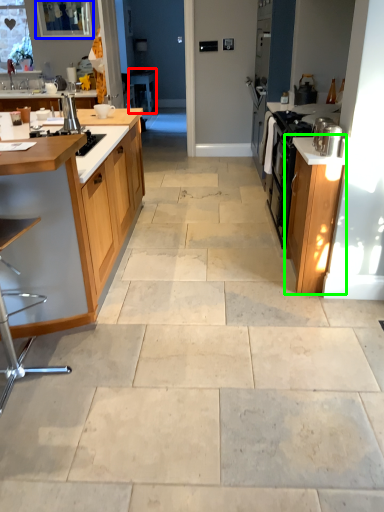
Question: Which object is positioned closest to table (highlighted by a red box)? Select from window screen (highlighted by a blue box) and cabinetry (highlighted by a green box).

Choices:
 (A) window screen
 (B) cabinetry

Answer: (A)